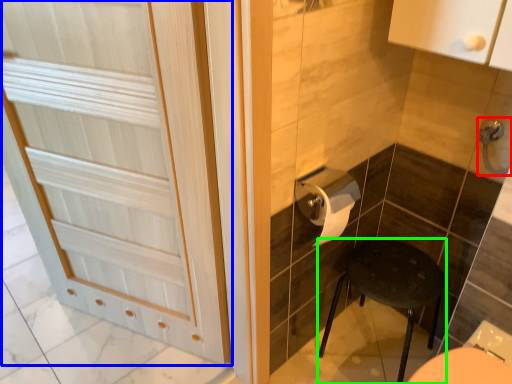
Question: Which object is positioned closest to door handle (highlighted by a red box)? Select from door (highlighted by a blue box) and furniture (highlighted by a green box).

Choices:
 (A) door
 (B) furniture

Answer: (B)